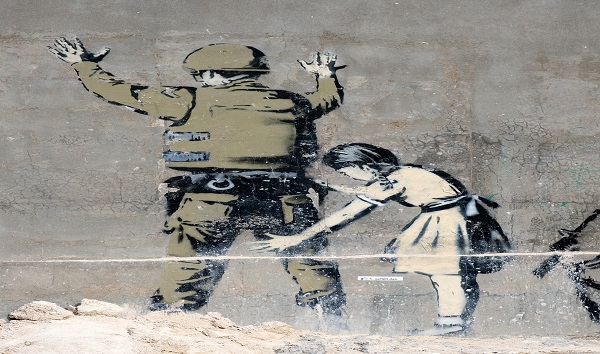
This screenshot has width=600, height=354. Identify the location of cracks in grey wall. (540, 143), (121, 198).